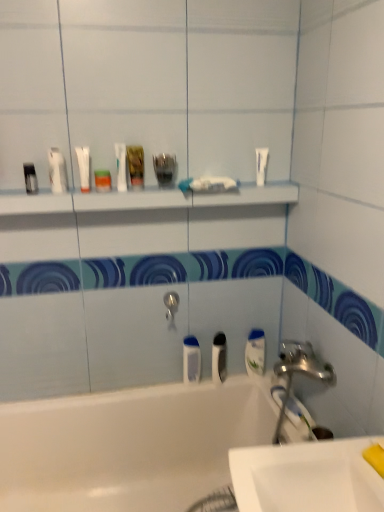
Locate an element on the screen. The image size is (384, 512). free location in front of white glossy mouthwash at right, which is the 3th mouthwash in top-to-bottom order is located at coordinates (266, 387).